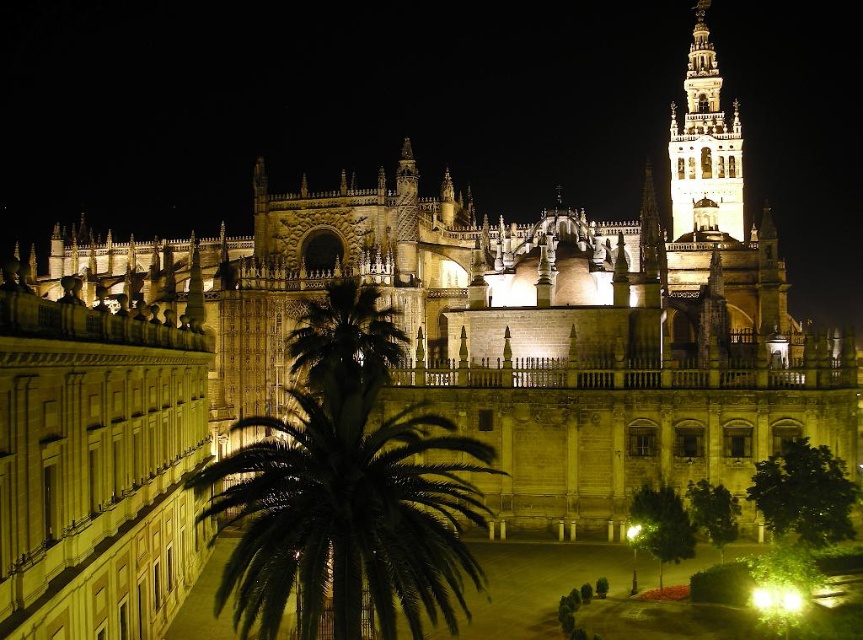
Who is higher up, green leafy palm at center or illuminated stone bell tower at upper right?

Positioned higher is illuminated stone bell tower at upper right.

Is green leafy palm at center closer to the viewer compared to illuminated stone bell tower at upper right?

Yes, it is.

What do you see at coordinates (347, 490) in the screenshot?
I see `green leafy palm at center` at bounding box center [347, 490].

The width and height of the screenshot is (863, 640). Identify the location of green leafy palm at center. (347, 490).